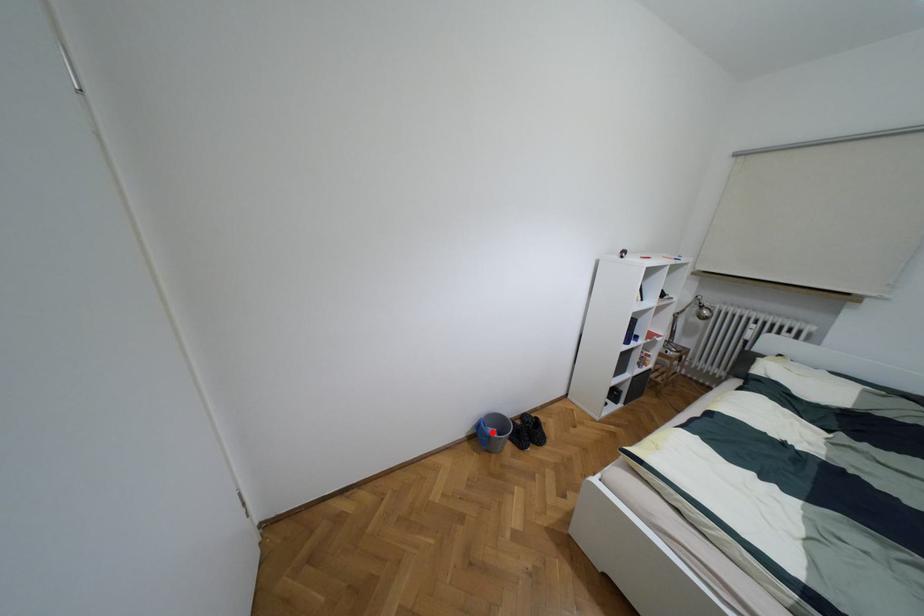
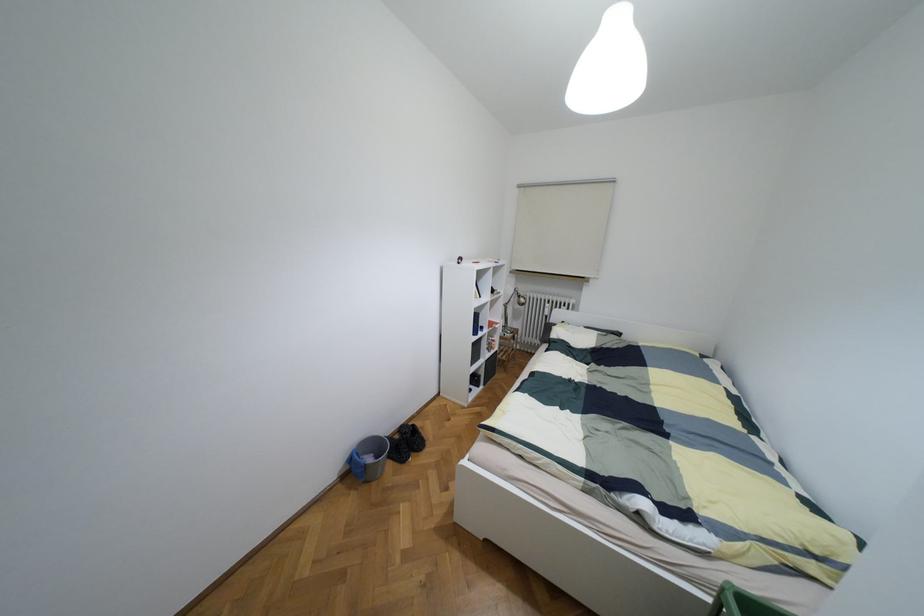
The point at the highlighted location is marked in the first image. Where is the corresponding point in the second image?

(369, 459)